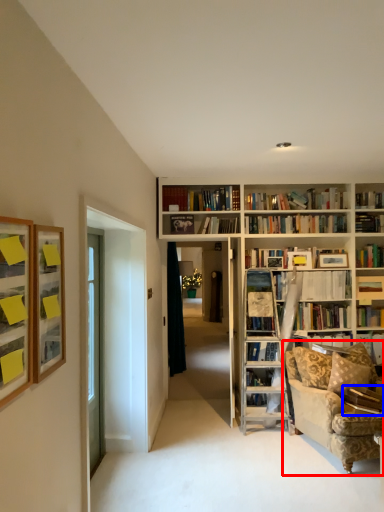
Question: Which object is closer to the camera taking this photo, studio couch (highlighted by a red box) or book (highlighted by a blue box)?

Choices:
 (A) studio couch
 (B) book

Answer: (A)